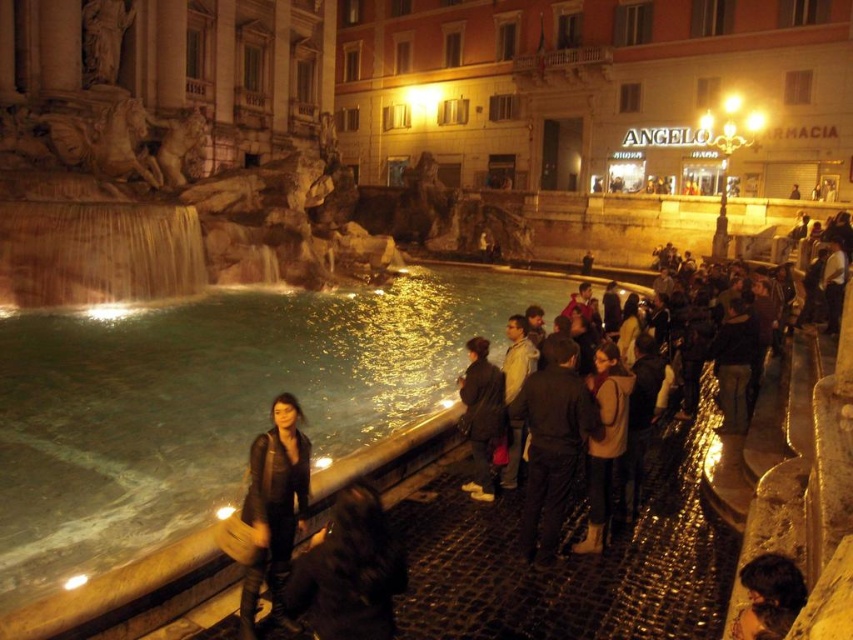
Who is higher up, dark brown leather jacket at center right or leather jacket at lower center?

dark brown leather jacket at center right is above.

Between point (746, 365) and point (271, 444), which one is positioned behind?

Point (746, 365)

Where is `dark brown leather jacket at center right`? Image resolution: width=853 pixels, height=640 pixels. dark brown leather jacket at center right is located at coordinates (x=828, y=435).

Which of these two, clear water at fountain left or leather jacket at center, stands taller?

clear water at fountain left

Does clear water at fountain left have a greater width compared to leather jacket at center?

Yes.

Identify the location of clear water at fountain left. (212, 403).

In the scene shown: Is dark brown leather jacket at center right closer to the viewer compared to dark brown leather jacket at center?

Yes, dark brown leather jacket at center right is closer to the viewer.

Measure the distance from dark brown leather jacket at center right to dark brown leather jacket at center.

dark brown leather jacket at center right is 6.04 meters from dark brown leather jacket at center.

Who is more forward, (x=848, y=456) or (x=509, y=420)?

Point (x=848, y=456)

The height and width of the screenshot is (640, 853). I want to click on dark brown leather jacket at center right, so click(x=828, y=435).